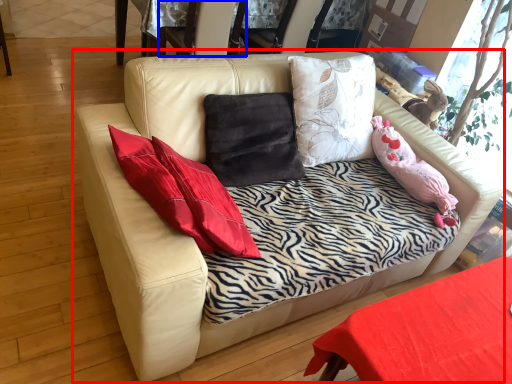
Question: Among these objects, which one is nearest to the camera, studio couch (highlighted by a red box) or armchair (highlighted by a blue box)?

Choices:
 (A) studio couch
 (B) armchair

Answer: (A)